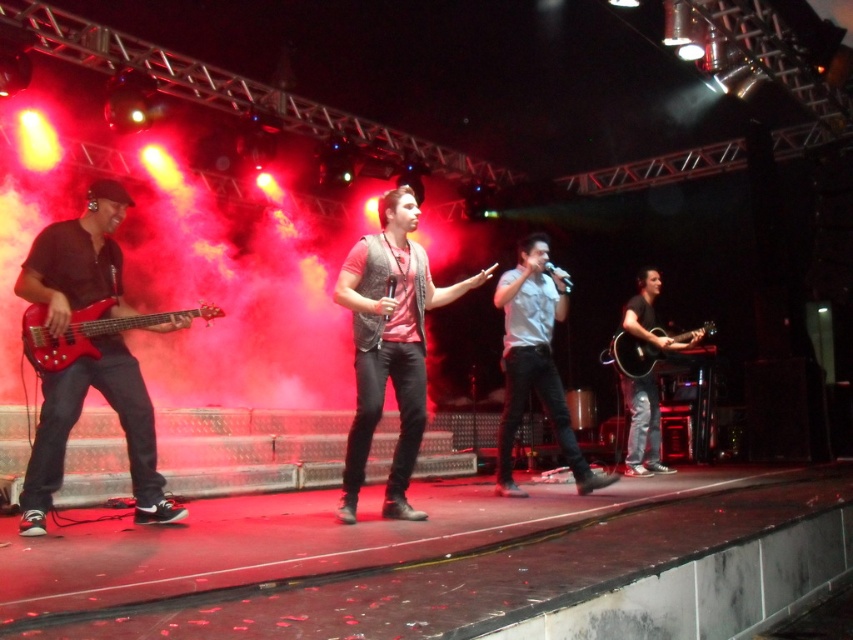
Question: Considering the real-world distances, which object is closest to the wooden acoustic guitar at right?

Choices:
 (A) gray matte shirt at center
 (B) denim vest at center

Answer: (A)

Question: Does denim vest at center come in front of shiny red electric guitar at left?

Choices:
 (A) yes
 (B) no

Answer: (B)

Question: Which of the following is the farthest from the observer?

Choices:
 (A) (566, 445)
 (B) (653, 356)

Answer: (B)

Question: Can you confirm if matte black bass guitar at left is positioned below acoustic guitar at right?

Choices:
 (A) yes
 (B) no

Answer: (B)

Question: Which point is farther to the camera?

Choices:
 (A) (547, 269)
 (B) (189, 317)
 (C) (607, 355)
 (D) (386, 300)

Answer: (C)

Question: Is the position of matte black bass guitar at left less distant than that of acoustic guitar at right?

Choices:
 (A) no
 (B) yes

Answer: (B)